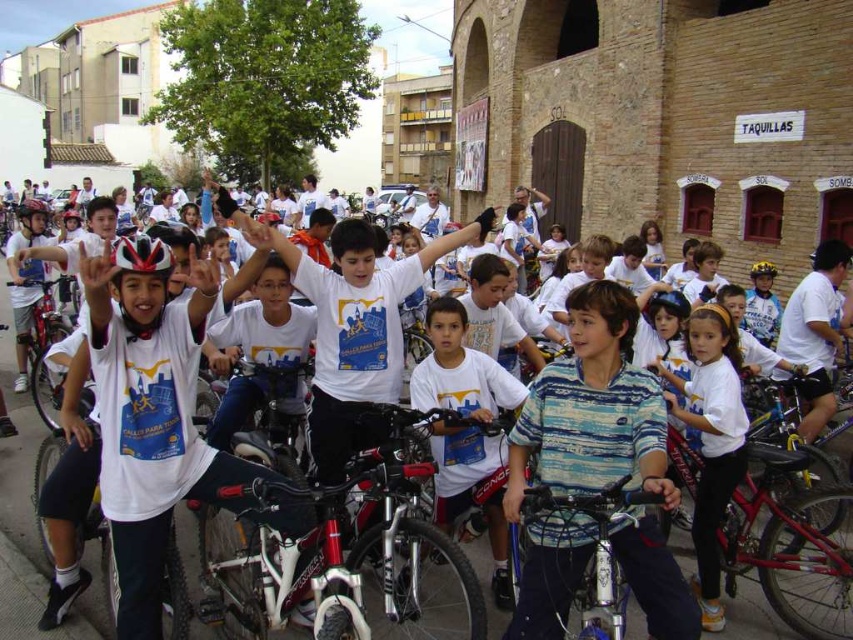
You are a photographer standing at the camera position in the scene. You want to take a closeup photo of the shiny red bicycle at center. Can you walk closer to the bicycle to get a better shot without leaving the current street area?

The shiny red bicycle at center is 26.75 meters away from camera. Since you can walk closer within the street area, you can move forward to reduce the distance and take a better closeup photo.